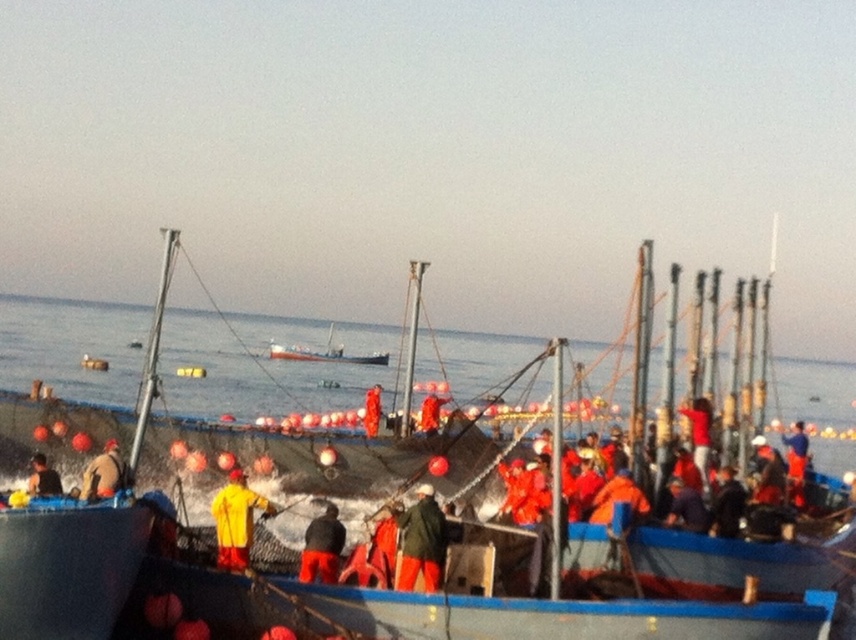
Question: Does blue plastic boat at center have a larger size compared to dark gray fabric jacket at center?

Choices:
 (A) yes
 (B) no

Answer: (A)

Question: Is orange fabric worker at lower left thinner than orange fabric worker at center?

Choices:
 (A) yes
 (B) no

Answer: (B)

Question: Which object is the farthest from the yellow matte jacket at center?

Choices:
 (A) white glossy boat at center
 (B) orange fabric worker at lower left

Answer: (A)

Question: Estimate the real-world distances between objects in this image. Which object is closer to the orange fabric worker at center?

Choices:
 (A) yellow matte jacket at center
 (B) blue plastic boat at center
 (C) green fabric jacket at center
 (D) orange fabric worker at lower left

Answer: (B)

Question: Can you confirm if orange fabric jacket at lower left is wider than orange fabric worker at center?

Choices:
 (A) yes
 (B) no

Answer: (A)

Question: Among these points, which one is farthest from the camera?

Choices:
 (A) (443, 525)
 (B) (138, 593)

Answer: (A)